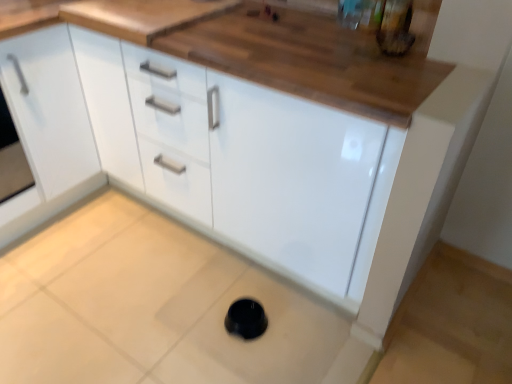
Find the location of a particular element. The height and width of the screenshot is (384, 512). black rubber manhole at center is located at coordinates (246, 319).

Image resolution: width=512 pixels, height=384 pixels. What do you see at coordinates (246, 319) in the screenshot?
I see `black rubber manhole at center` at bounding box center [246, 319].

This screenshot has height=384, width=512. I want to click on black rubber manhole at center, so click(x=246, y=319).